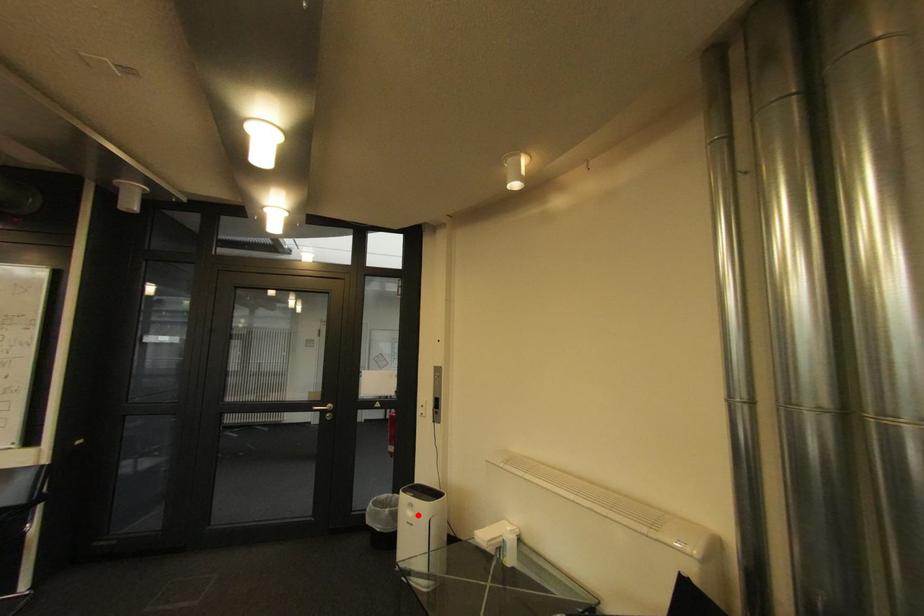
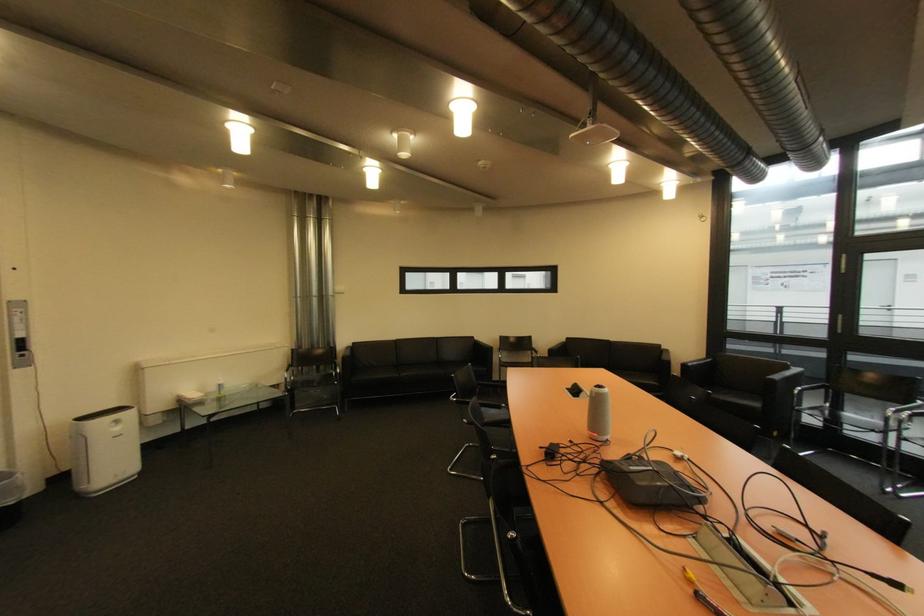
Question: A red point is marked in image1. In image2, is the corresponding 3D point closer to the camera or farther? Reply with the corresponding letter.

Choices:
 (A) The corresponding 3D point is closer.
 (B) The corresponding 3D point is farther.

Answer: (A)